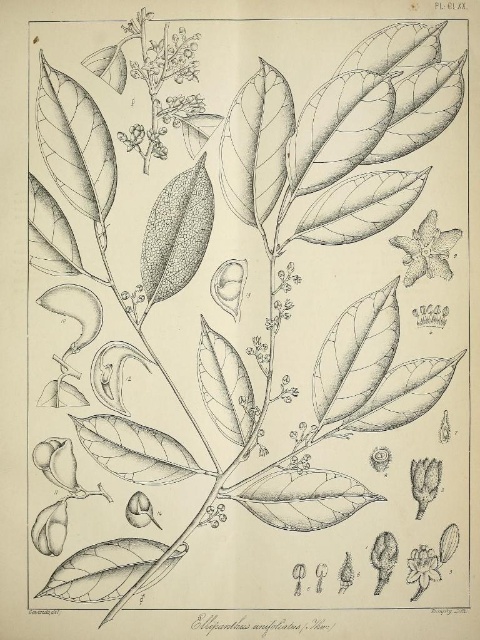
Question: Can you confirm if smooth white flower at upper right is smaller than white paper flower at lower right?

Choices:
 (A) yes
 (B) no

Answer: (B)

Question: Which point is farther to the camera?

Choices:
 (A) white paper flower at lower right
 (B) smooth white flower at upper right

Answer: (B)

Question: Is smooth white flower at upper right wider than white paper flower at lower right?

Choices:
 (A) no
 (B) yes

Answer: (B)

Question: Considering the relative positions of smooth white flower at upper right and white paper flower at lower right in the image provided, where is smooth white flower at upper right located with respect to white paper flower at lower right?

Choices:
 (A) above
 (B) below

Answer: (A)